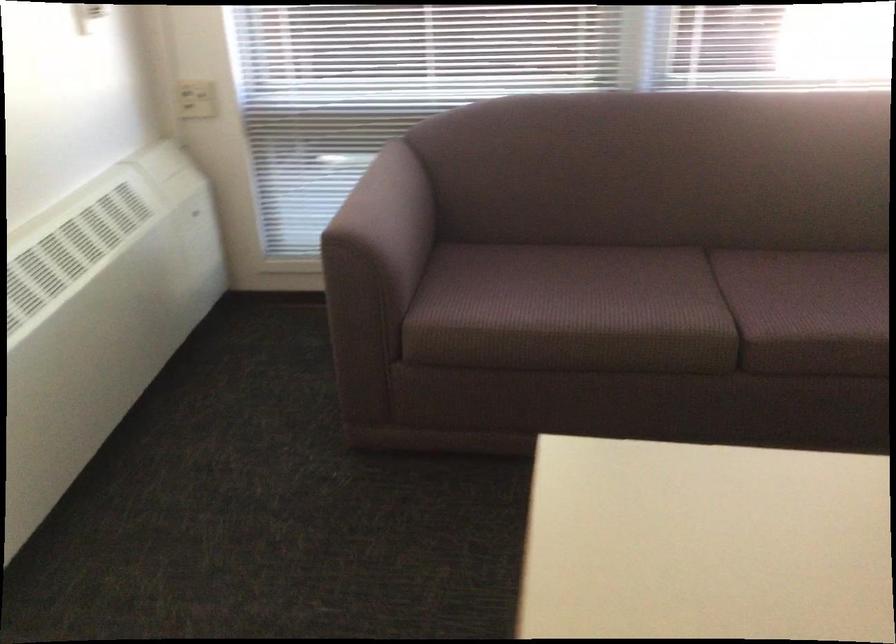
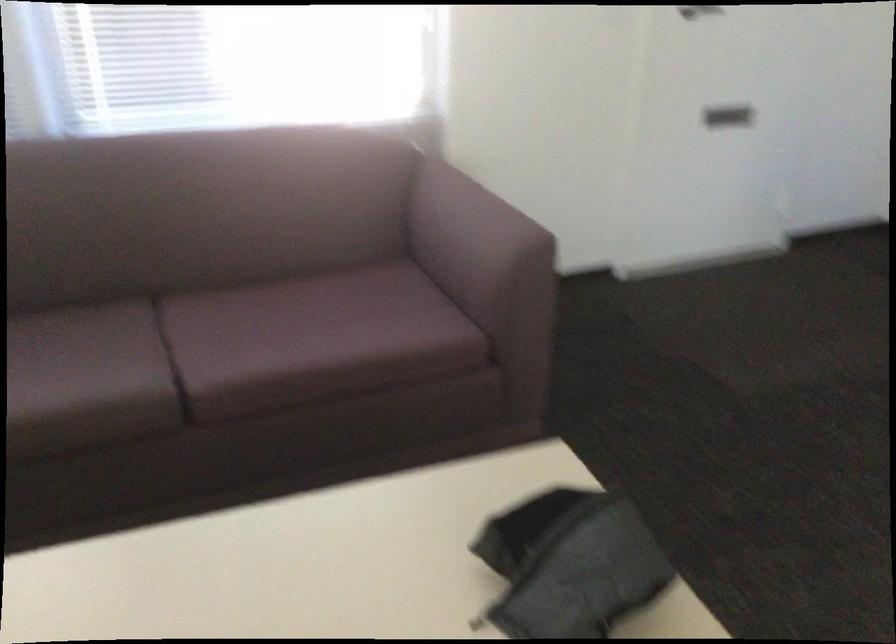
Question: Which direction would the cameraman need to move to produce the second image? Reply with the corresponding letter.

Choices:
 (A) Left
 (B) Right
 (C) Forward
 (D) Backward

Answer: (B)